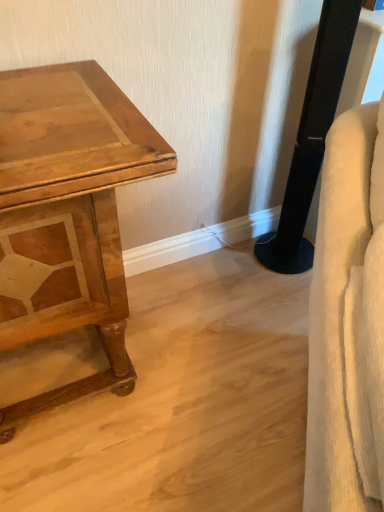
Locate an element on the screen. This screenshot has height=512, width=384. empty space that is to the right of wooden table at left is located at coordinates pos(215,357).